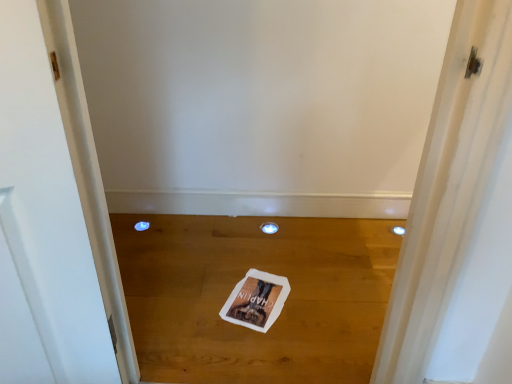
At what (x,y) coordinates should I click in order to perform the action: click on vacant space underneath white paper magazine at center (from a real-world perspective). Please return your answer as a coordinate pair (x, y). The image size is (512, 384). Looking at the image, I should click on (254, 295).